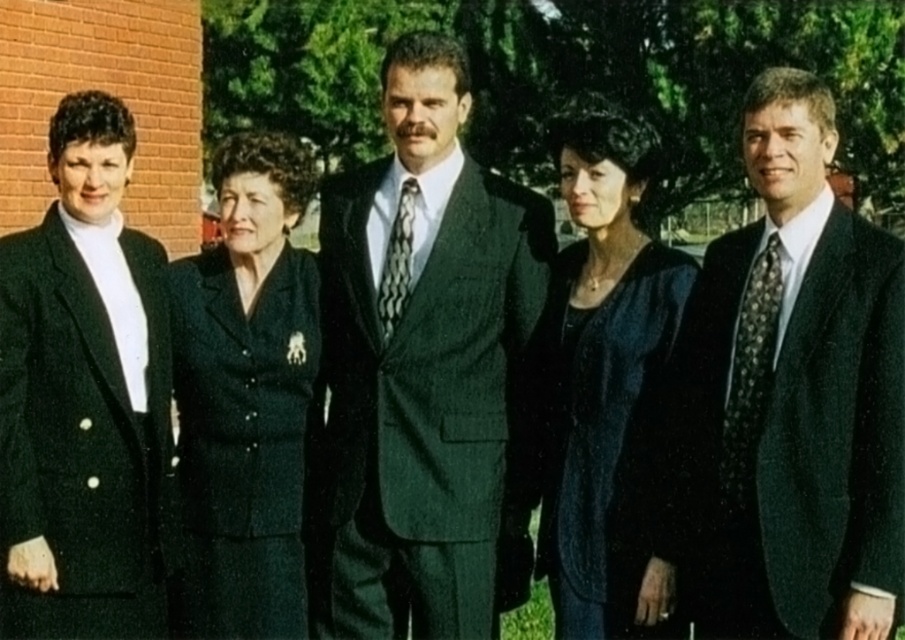
Question: Which object appears farthest from the camera in this image?

Choices:
 (A) velvet black coat at center
 (B) dark green suit at center

Answer: (B)

Question: Can you confirm if matte black suit at center is smaller than dark green suit at center?

Choices:
 (A) yes
 (B) no

Answer: (A)

Question: Is dark green textured suit at center smaller than black dotted tie at right?

Choices:
 (A) no
 (B) yes

Answer: (A)

Question: Considering the relative positions of dark green textured suit at center and black dotted tie at right in the image provided, where is dark green textured suit at center located with respect to black dotted tie at right?

Choices:
 (A) left
 (B) right

Answer: (A)

Question: Estimate the real-world distances between objects in this image. Which object is farther from the black dotted tie at right?

Choices:
 (A) dark green textured suit at center
 (B) velvet black coat at center
 (C) black textured tie at center
 (D) black wool suit at left

Answer: (D)

Question: Which object is farther from the camera taking this photo?

Choices:
 (A) velvet black coat at center
 (B) dark green textured suit at center

Answer: (B)